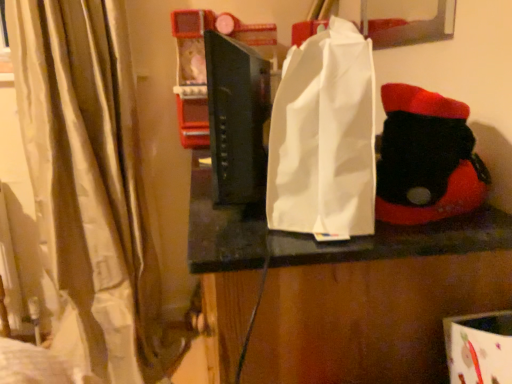
Question: Is white paper bag at center directly adjacent to black felt boot at right?

Choices:
 (A) no
 (B) yes

Answer: (A)

Question: Is white paper bag at center taller than black felt boot at right?

Choices:
 (A) yes
 (B) no

Answer: (A)

Question: Considering the relative positions of white paper bag at center and black felt boot at right in the image provided, is white paper bag at center to the right of black felt boot at right from the viewer's perspective?

Choices:
 (A) no
 (B) yes

Answer: (A)

Question: From a real-world perspective, is white paper bag at center physically above black felt boot at right?

Choices:
 (A) no
 (B) yes

Answer: (A)

Question: Does white paper bag at center appear on the left side of black felt boot at right?

Choices:
 (A) no
 (B) yes

Answer: (B)

Question: From a real-world perspective, is black felt boot at right physically located above or below white paper bag at center?

Choices:
 (A) above
 (B) below

Answer: (A)

Question: Based on their positions, is black felt boot at right located to the left or right of white paper bag at center?

Choices:
 (A) left
 (B) right

Answer: (B)

Question: Which is correct: black felt boot at right is inside white paper bag at center, or outside of it?

Choices:
 (A) inside
 (B) outside

Answer: (B)

Question: From the image's perspective, is black felt boot at right located above or below white paper bag at center?

Choices:
 (A) above
 (B) below

Answer: (A)

Question: In terms of height, does black matte book at center look taller or shorter compared to black felt boot at right?

Choices:
 (A) short
 (B) tall

Answer: (B)

Question: Considering their positions, is black matte book at center located in front of or behind black felt boot at right?

Choices:
 (A) behind
 (B) front

Answer: (A)

Question: Does point (228, 188) appear closer or farther from the camera than point (381, 173)?

Choices:
 (A) farther
 (B) closer

Answer: (A)

Question: Considering the positions of black matte book at center and black felt boot at right in the image, is black matte book at center wider or thinner than black felt boot at right?

Choices:
 (A) wide
 (B) thin

Answer: (B)

Question: Is white paper bag at center to the left or to the right of black matte book at center in the image?

Choices:
 (A) left
 (B) right

Answer: (B)

Question: Is point (359, 144) closer or farther from the camera than point (227, 183)?

Choices:
 (A) farther
 (B) closer

Answer: (B)